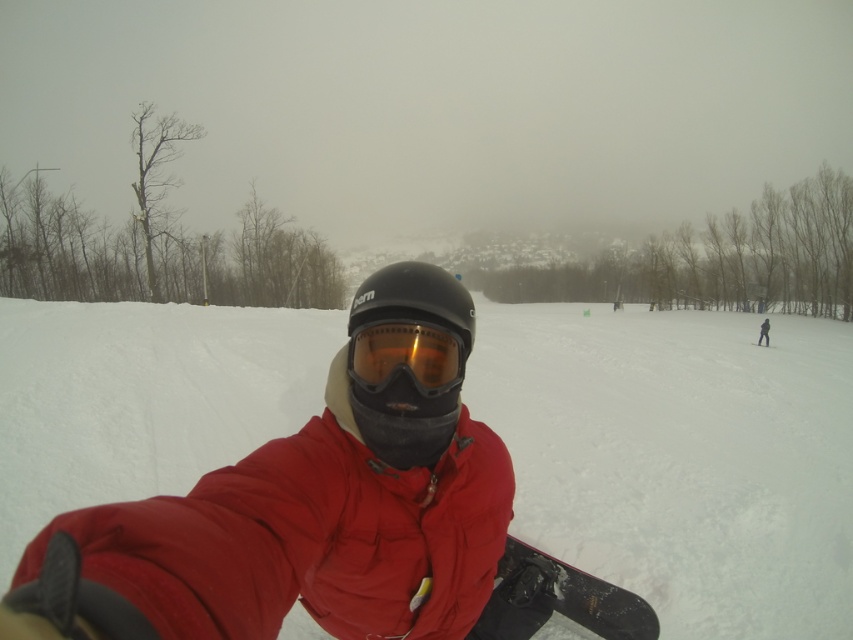
Is matte black helmet at center above orange reflective lens at center?

Incorrect, matte black helmet at center is not positioned above orange reflective lens at center.

Can you confirm if matte black helmet at center is smaller than orange reflective lens at center?

Actually, matte black helmet at center might be larger than orange reflective lens at center.

What do you see at coordinates (408, 360) in the screenshot? I see `matte black helmet at center` at bounding box center [408, 360].

The height and width of the screenshot is (640, 853). I want to click on matte black helmet at center, so click(x=408, y=360).

From the picture: Does white matte snow at center appear on the right side of orange reflective lens at center?

Correct, you'll find white matte snow at center to the right of orange reflective lens at center.

Is white matte snow at center above orange reflective lens at center?

Incorrect, white matte snow at center is not positioned above orange reflective lens at center.

Who is more forward, (198, 314) or (428, 358)?

Positioned in front is point (428, 358).

Find the location of a particular element. white matte snow at center is located at coordinates (680, 458).

Does black matte snowboard at lower center have a lesser width compared to orange reflective lens at center?

No, black matte snowboard at lower center is not thinner than orange reflective lens at center.

Who is more distant from viewer, (619, 588) or (376, 392)?

Positioned behind is point (619, 588).

Which is behind, point (505, 576) or point (445, 342)?

Positioned behind is point (505, 576).

The height and width of the screenshot is (640, 853). Identify the location of black matte snowboard at lower center. coord(556,600).